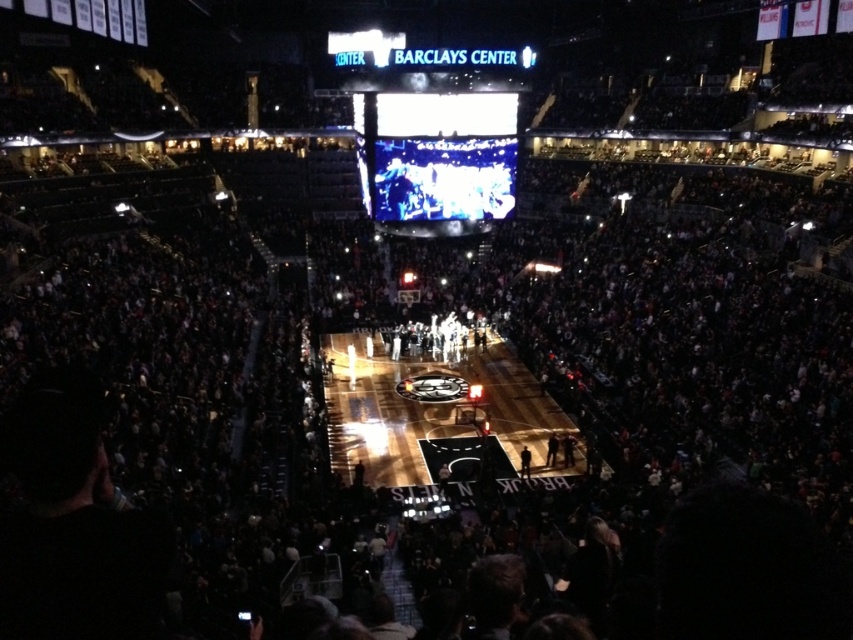
Question: Does dark gray fabric jacket at center have a greater width compared to dark brown leather jacket at center?

Choices:
 (A) no
 (B) yes

Answer: (A)

Question: Is dark gray fabric jacket at center below dark brown leather jacket at center?

Choices:
 (A) no
 (B) yes

Answer: (A)

Question: Can you confirm if glossy wooden court at center is positioned above dark gray fabric jacket at center?

Choices:
 (A) yes
 (B) no

Answer: (A)

Question: Which object appears farthest from the camera in this image?

Choices:
 (A) dark brown leather jacket at center
 (B) glossy wooden court at center
 (C) dark gray fabric jacket at center

Answer: (C)

Question: Considering the real-world distances, which object is closest to the glossy wooden court at center?

Choices:
 (A) dark gray fabric jacket at center
 (B) dark brown leather jacket at center

Answer: (B)

Question: Among these points, which one is nearest to the camera?

Choices:
 (A) (480, 348)
 (B) (523, 474)
 (C) (555, 451)

Answer: (B)